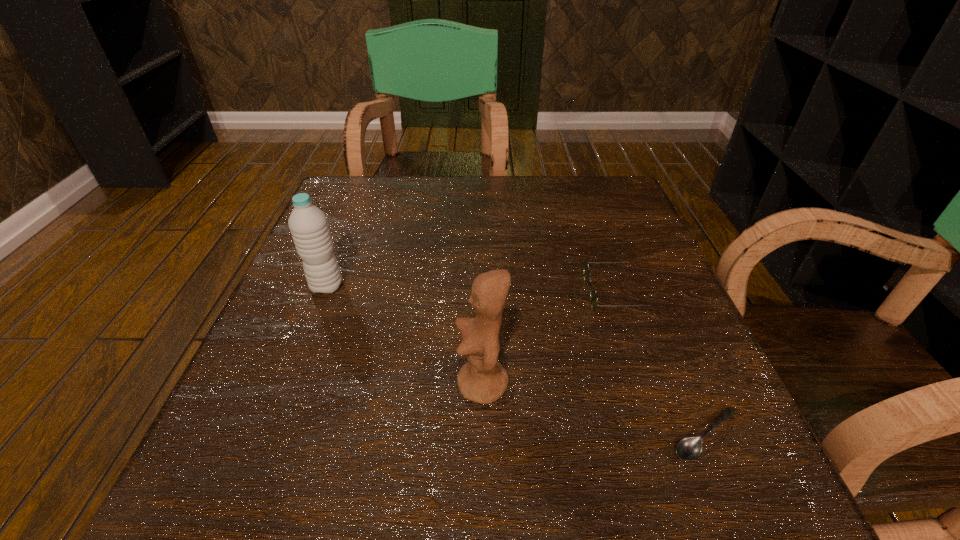
Image resolution: width=960 pixels, height=540 pixels. In order to click on vacant space at the right edge in this screenshot , I will do `click(638, 275)`.

Where is `free region at the far left corner`? This screenshot has width=960, height=540. free region at the far left corner is located at coordinates (376, 187).

At what (x,y) coordinates should I click in order to perform the action: click on free space between the shortest object and the leftmost object. Please return your answer as a coordinate pair (x, y). Looking at the image, I should click on (516, 361).

The image size is (960, 540). I want to click on unoccupied position between the soupspoon and the third tallest object, so click(662, 364).

This screenshot has height=540, width=960. I want to click on free space between the soupspoon and the water bottle, so click(x=516, y=361).

Image resolution: width=960 pixels, height=540 pixels. I want to click on empty space between the sunglasses and the shortest object, so click(662, 364).

Identify the location of vacant space in between the soupspoon and the figurine. (594, 409).

Where is `free space between the second object from left to right and the second shortest object`? This screenshot has width=960, height=540. free space between the second object from left to right and the second shortest object is located at coordinates (551, 339).

Identify the location of vacant area that lies between the water bottle and the soupspoon. (516, 361).

Locate an element on the screen. The width and height of the screenshot is (960, 540). free spot between the leftmost object and the shortest object is located at coordinates (516, 361).